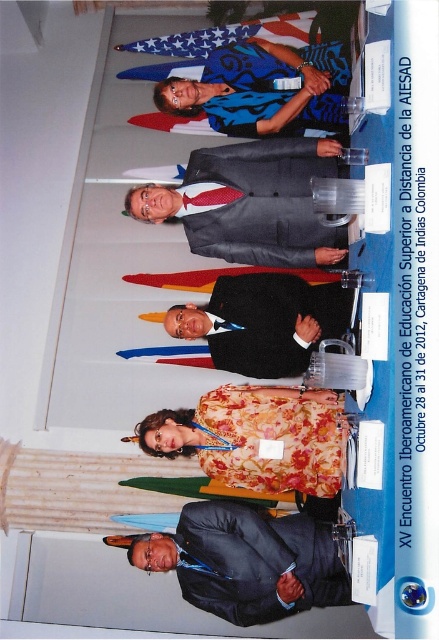
Based on the scene description, where is the dark gray suit at lower center located in the image?

The dark gray suit at lower center is located at point (244, 561) in the image.

You are a photographer at the event and need to adjust the lighting for a closeup shot of the black suit at center and shiny red tie at center. The camera requires a minimum distance of 50 centimeters between the two objects to focus properly. Can you proceed with the current setup?

The black suit at center is 53.83 centimeters away from the shiny red tie at center, which exceeds the minimum required distance of 50 centimeters. Therefore, the camera can focus properly, and you can proceed with the current setup.

You are standing in the conference hall at the XV Encuentro Iberoamericano de Educational Superior a Distancia de la AIESAD. You want to place a 7.5 feet wide banner between the camera and the point at coordinates point (x=182, y=568). Will the banner fit without overlapping the point?

The distance from the camera to the point is 8.24 feet, and the banner is 7.5 feet wide. Since the banner is shorter than the distance, it can be placed between the camera and the point without overlapping.